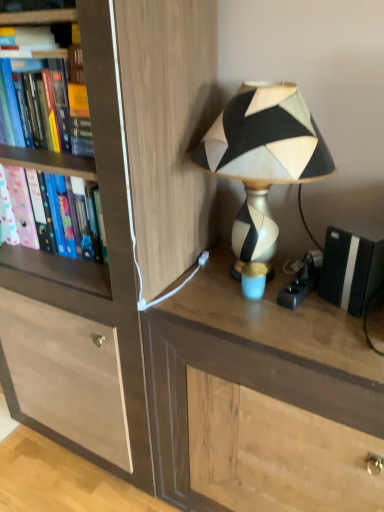
Locate an element on the screen. Image resolution: width=384 pixels, height=512 pixels. vacant area that is in front of black matte speaker at right is located at coordinates (x=349, y=342).